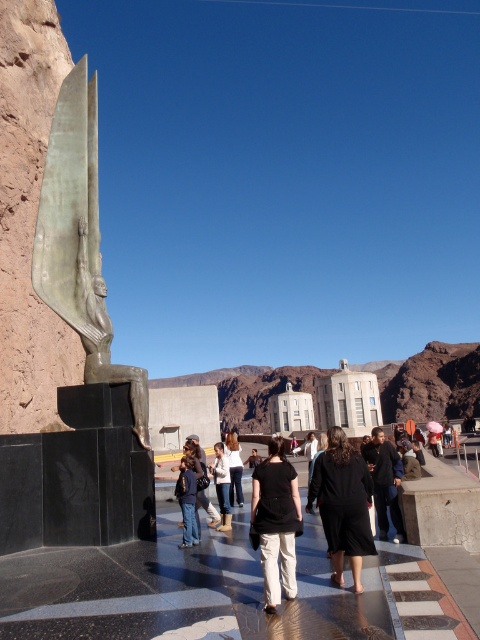
Can you confirm if dark brown leather jacket at center is thinner than dark blue jeans at center?

Incorrect, dark brown leather jacket at center's width is not less than dark blue jeans at center's.

Is point (382, 508) closer to camera compared to point (210, 506)?

Yes, point (382, 508) is closer to viewer.

At what (x,y) coordinates should I click in order to perform the action: click on dark brown leather jacket at center. Please return your answer as a coordinate pair (x, y). Looking at the image, I should click on (384, 481).

Is point (269, 515) positioned before point (373, 448)?

Yes, it is in front of point (373, 448).

Who is shorter, black cotton pants at center or dark brown leather jacket at center?

black cotton pants at center

Who is more distant from viewer, [257,470] or [391,461]?

The point [391,461] is more distant.

Where is `black cotton pants at center`? Image resolution: width=480 pixels, height=640 pixels. black cotton pants at center is located at coordinates (276, 522).

Is green polished stone statue at left bigger than denim jeans at center?

Yes, green polished stone statue at left is bigger than denim jeans at center.

What do you see at coordinates (80, 240) in the screenshot? I see `green polished stone statue at left` at bounding box center [80, 240].

The image size is (480, 640). Find the location of `green polished stone statue at left`. green polished stone statue at left is located at coordinates (80, 240).